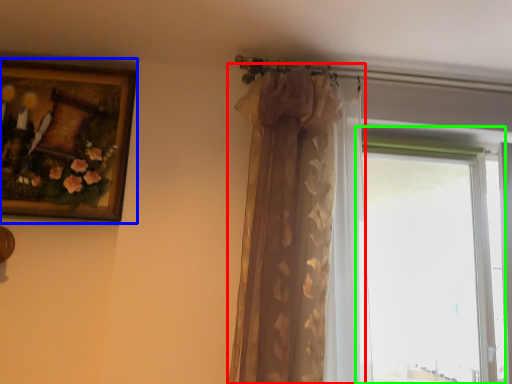
Question: Based on their relative distances, which object is farther from curtain (highlighted by a red box)? Choose from picture frame (highlighted by a blue box) and window (highlighted by a green box).

Choices:
 (A) picture frame
 (B) window

Answer: (B)